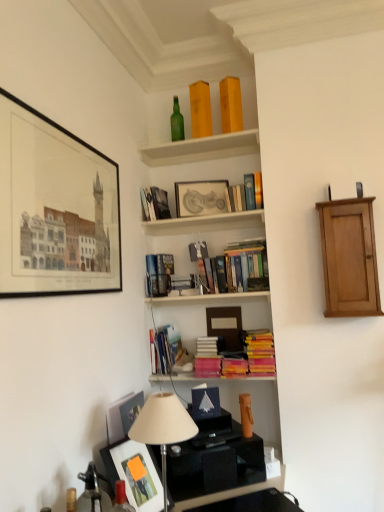
I want to click on free space to the right of matte silver picture frame at center, the 2th picture frame when ordered from front to back, so click(x=225, y=219).